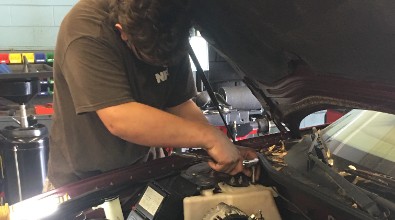
Where is `brick wall`? brick wall is located at coordinates (27, 18).